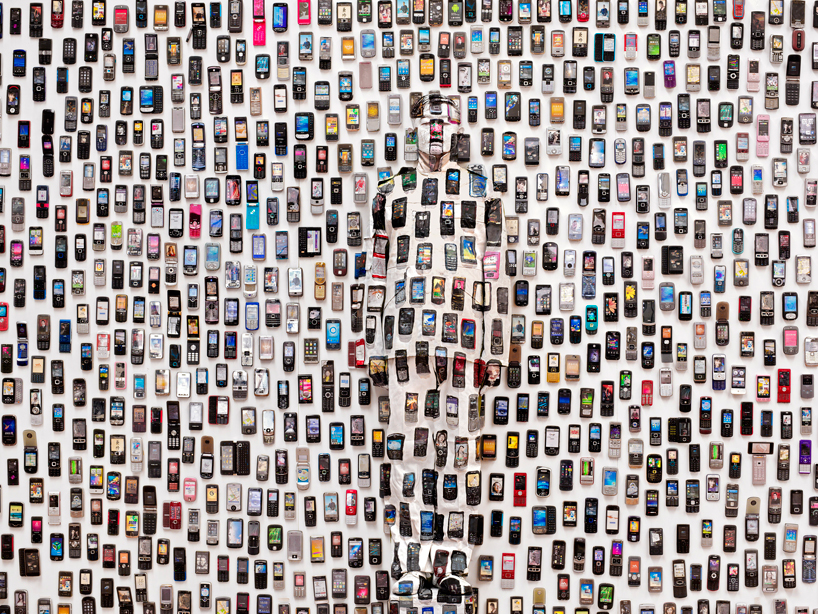
Find the location of a particular element. phone is located at coordinates (510, 567).